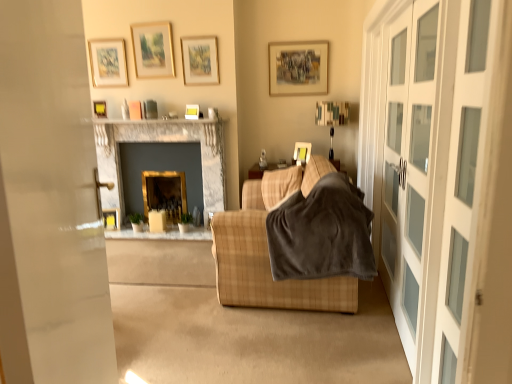
Question: Is velvety brown blanket at center located outside matte gold picture frame at upper left, which ranks as the 6th picture frame in right-to-left order?

Choices:
 (A) yes
 (B) no

Answer: (A)

Question: Is velvety brown blanket at center wider than matte gold picture frame at upper left, the third picture frame from the left?

Choices:
 (A) no
 (B) yes

Answer: (B)

Question: Does velvety brown blanket at center touch matte gold picture frame at upper left, the third picture frame from the left?

Choices:
 (A) no
 (B) yes

Answer: (A)

Question: Can you confirm if velvety brown blanket at center is positioned to the right of matte gold picture frame at upper left, which ranks as the 6th picture frame in right-to-left order?

Choices:
 (A) no
 (B) yes

Answer: (B)

Question: Is velvety brown blanket at center surrounding matte gold picture frame at upper left, which ranks as the 6th picture frame in right-to-left order?

Choices:
 (A) yes
 (B) no

Answer: (B)

Question: Would you say marble fireplace at center, arranged as the 2th fireplace when viewed from the right, is inside or outside matte gold picture frame at upper center, the 5th picture frame in the right-to-left sequence?

Choices:
 (A) outside
 (B) inside

Answer: (A)

Question: Visually, is marble fireplace at center, arranged as the 2th fireplace when viewed from the right, positioned to the left or to the right of matte gold picture frame at upper center, which is the 4th picture frame in left-to-right order?

Choices:
 (A) right
 (B) left

Answer: (A)

Question: Considering the positions of point (210, 127) and point (133, 46), is point (210, 127) closer or farther from the camera than point (133, 46)?

Choices:
 (A) farther
 (B) closer

Answer: (B)

Question: Relative to matte gold picture frame at upper center, which is the 4th picture frame in left-to-right order, is marble fireplace at center, which is the first fireplace in left-to-right order, in front or behind?

Choices:
 (A) behind
 (B) front

Answer: (B)

Question: Considering the positions of point (99, 119) and point (110, 52), is point (99, 119) closer or farther from the camera than point (110, 52)?

Choices:
 (A) farther
 (B) closer

Answer: (A)

Question: Considering the positions of marble fireplace at upper center and matte gold picture frame at upper left, which ranks as the 6th picture frame in right-to-left order, in the image, is marble fireplace at upper center bigger or smaller than matte gold picture frame at upper left, which ranks as the 6th picture frame in right-to-left order,?

Choices:
 (A) big
 (B) small

Answer: (A)

Question: Considering the relative positions of marble fireplace at upper center and matte gold picture frame at upper left, the third picture frame from the left, in the image provided, is marble fireplace at upper center to the left or to the right of matte gold picture frame at upper left, the third picture frame from the left,?

Choices:
 (A) right
 (B) left

Answer: (A)

Question: Is marble fireplace at upper center taller or shorter than matte gold picture frame at upper left, the third picture frame from the left?

Choices:
 (A) short
 (B) tall

Answer: (A)

Question: Relative to wooden picture frame at lower left, the seventh picture frame from the right, is plaid fabric couch at center in front or behind?

Choices:
 (A) front
 (B) behind

Answer: (A)

Question: From a real-world perspective, is plaid fabric couch at center physically located above or below wooden picture frame at lower left, the seventh picture frame from the right?

Choices:
 (A) below
 (B) above

Answer: (B)